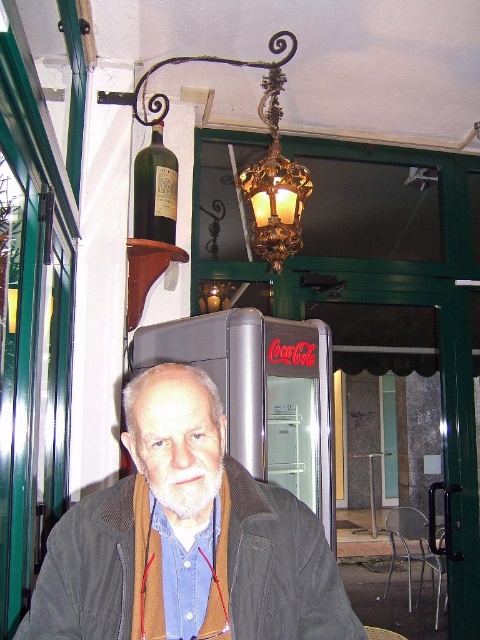
You are a customer at the cafe and want to place your phone on the metallic silver table at center. However, you notice the green glass bottle at upper left. Is the bottle blocking the table from your view?

The green glass bottle at upper left is in front of the metallic silver table at center, so it is blocking the table from your view.

You are a customer entering the cafe and want to grab the green glass bottle at upper left. However, there is a man in a brown corduroy jacket at center blocking your path. Can you reach the bottle without moving the man?

The brown corduroy jacket at center is to the right of the green glass bottle at upper left, so you can reach the green glass bottle at upper left by moving around the left side of the jacket since it is positioned to the right of the bottle.

You are a delivery person who needs to place a large package on a surface. You see the green glass bottle at upper left and the metallic silver table at center. Which object can support the package?

The metallic silver table at center can support the package because it is larger than the green glass bottle at upper left.